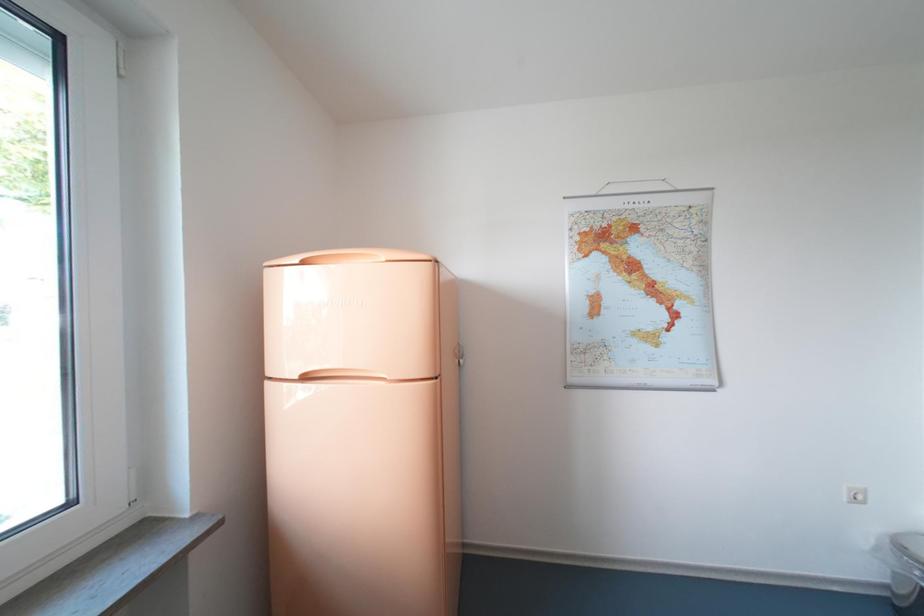
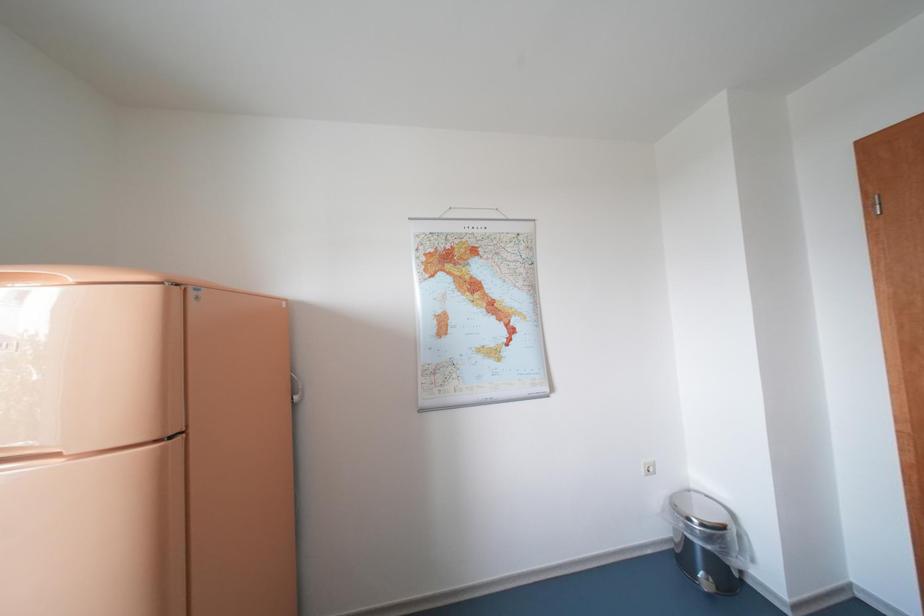
Question: Which direction would the cameraman need to move to produce the second image? Reply with the corresponding letter.

Choices:
 (A) Left
 (B) Right
 (C) Forward
 (D) Backward

Answer: (B)